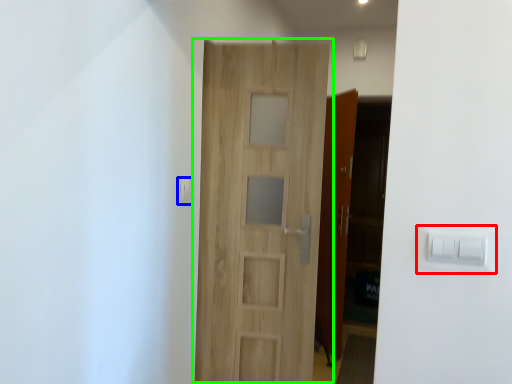
Question: Which object is the farthest from light switch (highlighted by a red box)? Choose among these: light switch (highlighted by a blue box) or door (highlighted by a green box).

Choices:
 (A) light switch
 (B) door

Answer: (A)